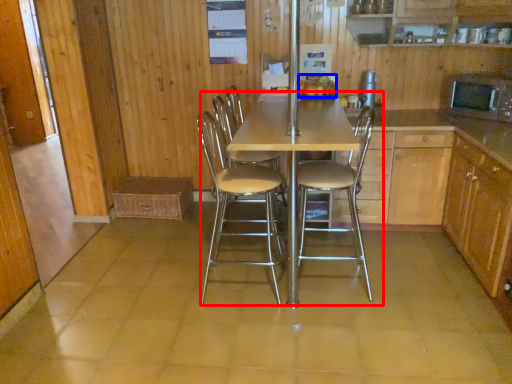
Question: Which point is further to the camera, kitchen & dining room table (highlighted by a red box) or fruit (highlighted by a blue box)?

Choices:
 (A) kitchen & dining room table
 (B) fruit

Answer: (B)